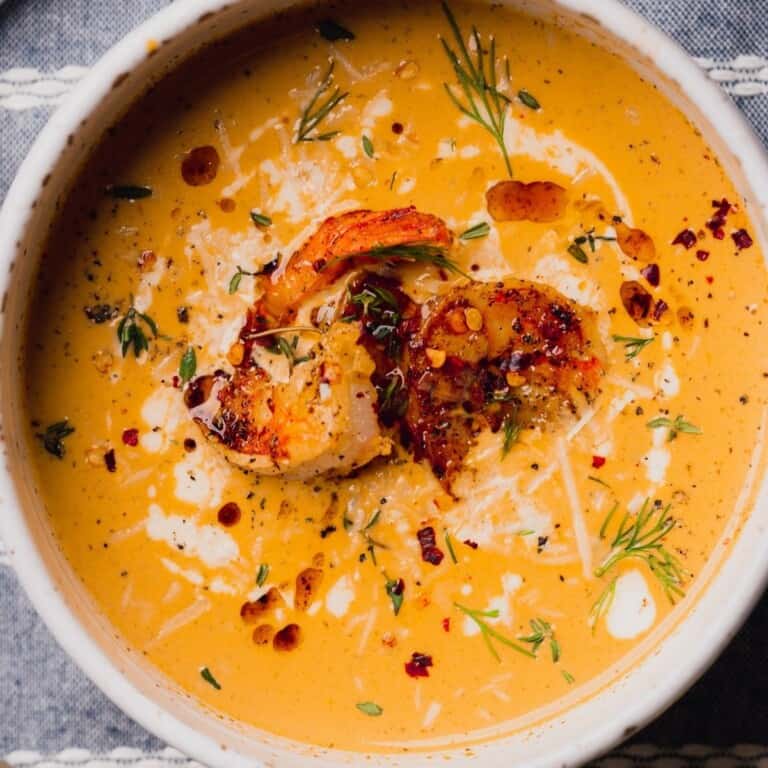
Locate an element on the screen. This screenshot has height=768, width=768. white bowl is located at coordinates (682, 653).